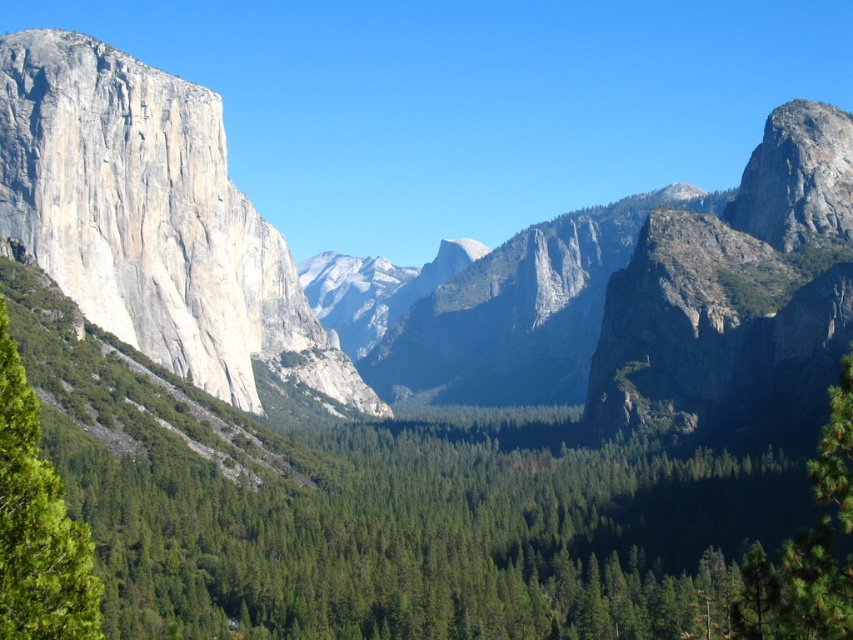
You are a geologist standing at the center of the valley. You need to locate the granite cliff face at left. According to your map, it should be at coordinates approximately 0.345 in the x and 0.179 in the y. Are you currently facing the correct direction to see it?

The granite cliff face at left is positioned at point (152, 220), so if you are at the center of the valley, you should be facing towards the left side to see it.

You are a hiker planning to cross the valley. You notice the gray rock formation at center and the green leafy tree at left. Which object is wider from your perspective?

The gray rock formation at center is wider than the green leafy tree at left.